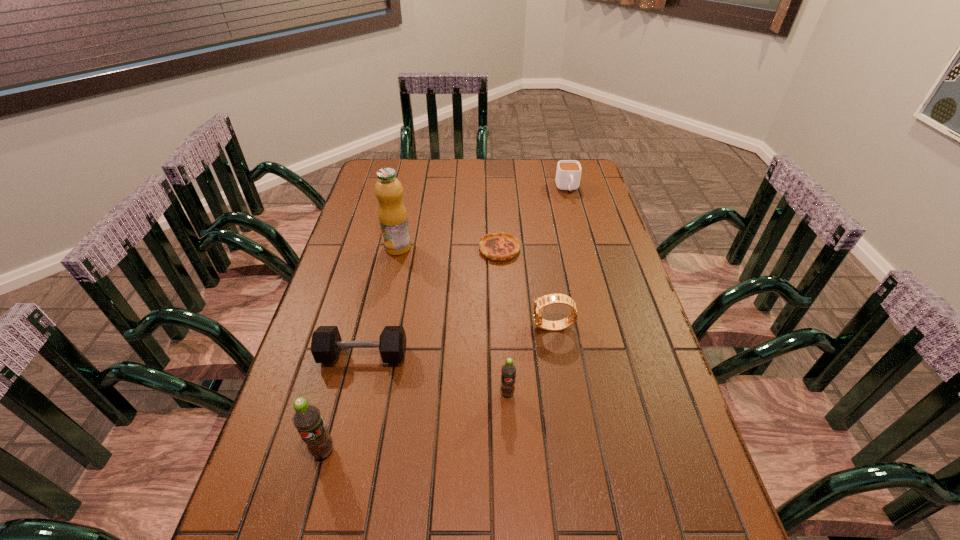
Please point a spot on the right to add another soda. Please provide its 2D coordinates. Your answer should be formatted as a tuple, i.e. [(x, y)], where the tuple contains the x and y coordinates of a point satisfying the conditions above.

[(658, 345)]